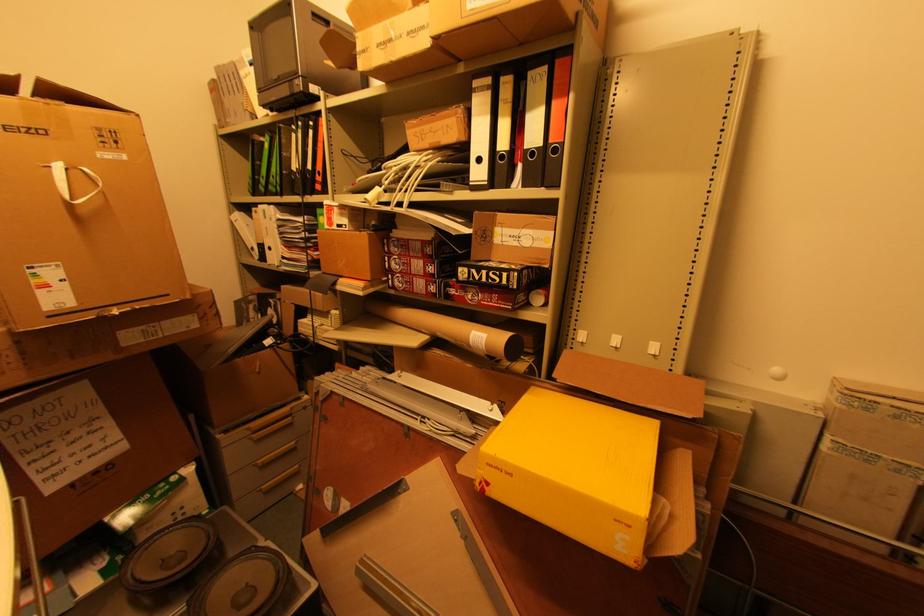
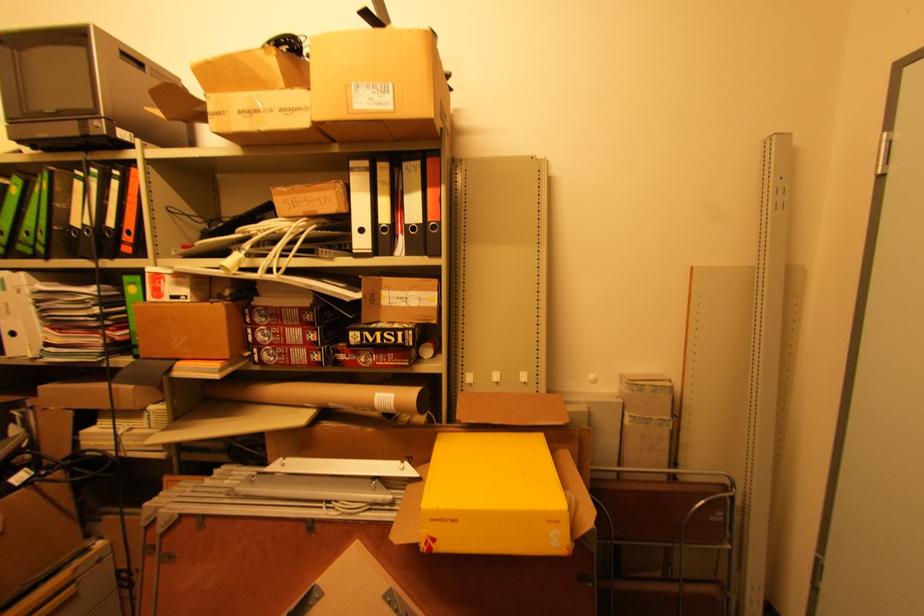
Where in the second image is the point corresponding to point 502,150 from the first image?

(383, 223)